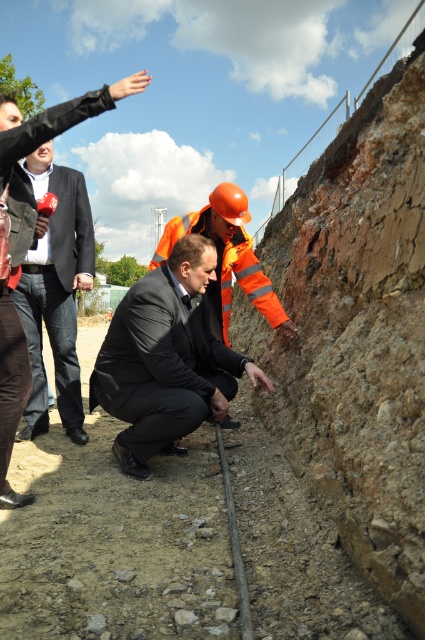
Is matte black suit at center above reflective orange safety vest at center?

No, matte black suit at center is not above reflective orange safety vest at center.

The height and width of the screenshot is (640, 425). In order to click on matte black suit at center in this screenshot , I will do `click(161, 364)`.

Find the location of a particular element. matte black suit at center is located at coordinates (161, 364).

Is matte black suit at left taller than reflective orange safety vest at center?

Yes, matte black suit at left is taller than reflective orange safety vest at center.

The height and width of the screenshot is (640, 425). Describe the element at coordinates (56, 292) in the screenshot. I see `matte black suit at left` at that location.

Where is `matte black suit at left`? The height and width of the screenshot is (640, 425). matte black suit at left is located at coordinates (56, 292).

Can you confirm if matte black suit at center is thinner than matte black suit at left?

In fact, matte black suit at center might be wider than matte black suit at left.

Can you confirm if matte black suit at center is taller than matte black suit at left?

No, matte black suit at center is not taller than matte black suit at left.

The image size is (425, 640). Find the location of `matte black suit at center`. matte black suit at center is located at coordinates (161, 364).

This screenshot has height=640, width=425. Identify the location of matte black suit at center. (161, 364).